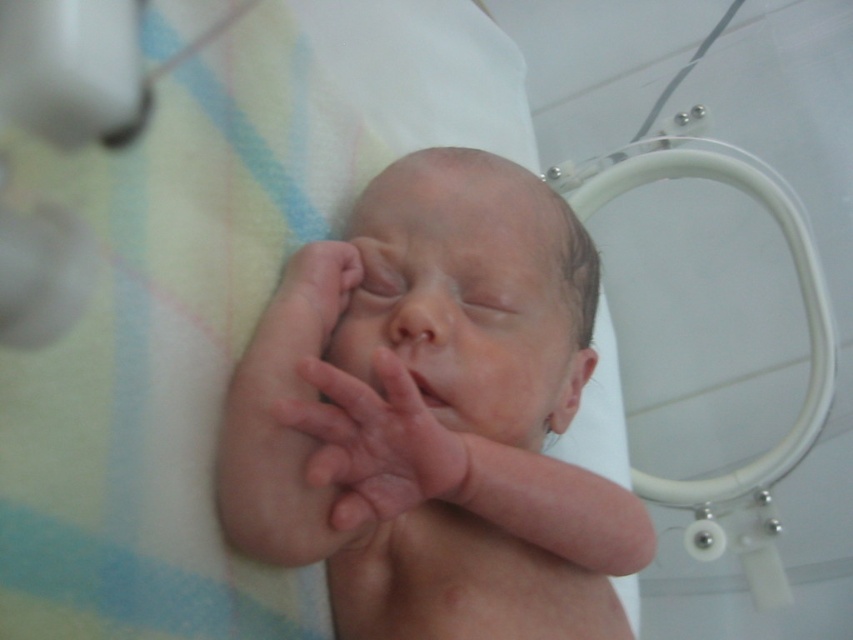
Question: Is smooth skin baby at center to the right of pink smooth skin at center from the viewer's perspective?

Choices:
 (A) no
 (B) yes

Answer: (B)

Question: Does smooth skin baby at center come in front of pink smooth skin at center?

Choices:
 (A) no
 (B) yes

Answer: (A)

Question: Which point is farther to the camera?

Choices:
 (A) (316, 417)
 (B) (357, 529)

Answer: (B)

Question: Is smooth skin baby at center to the left of pink smooth skin at center from the viewer's perspective?

Choices:
 (A) yes
 (B) no

Answer: (B)

Question: Which of the following is the farthest from the observer?

Choices:
 (A) (357, 371)
 (B) (381, 445)

Answer: (A)